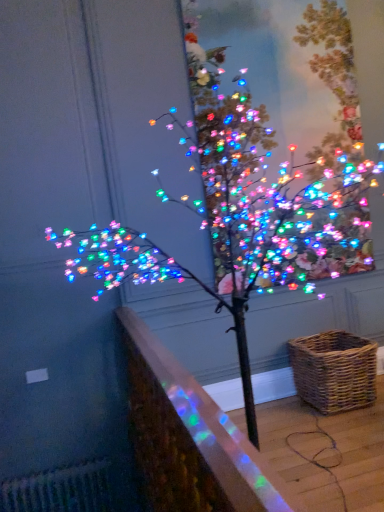
Question: Is woven brown picnic basket at lower right at the right side of translucent glass railing at lower left?

Choices:
 (A) yes
 (B) no

Answer: (A)

Question: From a real-world perspective, is woven brown picnic basket at lower right beneath translucent glass railing at lower left?

Choices:
 (A) no
 (B) yes

Answer: (B)

Question: Is woven brown picnic basket at lower right to the left of translucent glass railing at lower left from the viewer's perspective?

Choices:
 (A) no
 (B) yes

Answer: (A)

Question: Are woven brown picnic basket at lower right and translucent glass railing at lower left making contact?

Choices:
 (A) yes
 (B) no

Answer: (B)

Question: Does woven brown picnic basket at lower right have a greater height compared to translucent glass railing at lower left?

Choices:
 (A) no
 (B) yes

Answer: (A)

Question: Can you confirm if woven brown picnic basket at lower right is bigger than translucent glass railing at lower left?

Choices:
 (A) no
 (B) yes

Answer: (A)

Question: Is translucent glass railing at lower left positioned in front of woven brown picnic basket at lower right?

Choices:
 (A) no
 (B) yes

Answer: (B)

Question: Is translucent glass railing at lower left taller than woven brown picnic basket at lower right?

Choices:
 (A) yes
 (B) no

Answer: (A)

Question: Considering the relative positions of translucent glass railing at lower left and woven brown picnic basket at lower right in the image provided, is translucent glass railing at lower left to the left of woven brown picnic basket at lower right from the viewer's perspective?

Choices:
 (A) yes
 (B) no

Answer: (A)

Question: Does translucent glass railing at lower left touch woven brown picnic basket at lower right?

Choices:
 (A) yes
 (B) no

Answer: (B)

Question: Considering the relative sizes of translucent glass railing at lower left and woven brown picnic basket at lower right in the image provided, is translucent glass railing at lower left wider than woven brown picnic basket at lower right?

Choices:
 (A) yes
 (B) no

Answer: (B)

Question: Is translucent glass railing at lower left oriented towards woven brown picnic basket at lower right?

Choices:
 (A) no
 (B) yes

Answer: (B)

Question: Can you confirm if multicolored lights at upper center is smaller than translucent glass railing at lower left?

Choices:
 (A) yes
 (B) no

Answer: (A)